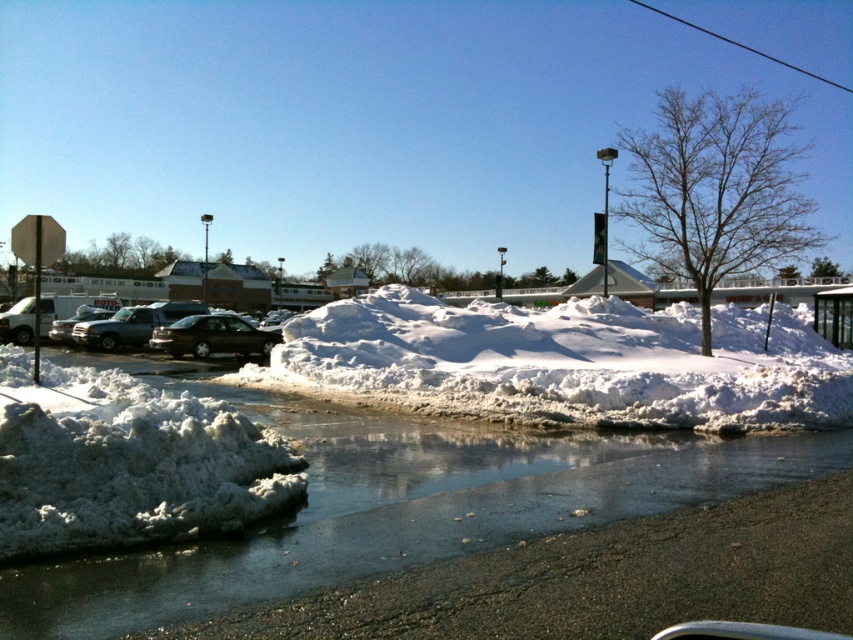
Question: Is the position of white fluffy snow at lower left less distant than that of matte black suv at center?

Choices:
 (A) yes
 (B) no

Answer: (A)

Question: Is white fluffy snow at center to the right of matte black suv at center from the viewer's perspective?

Choices:
 (A) no
 (B) yes

Answer: (B)

Question: Which object appears farthest from the camera in this image?

Choices:
 (A) matte black suv at center
 (B) white fluffy snow at center

Answer: (A)

Question: Which object is closer to the camera taking this photo?

Choices:
 (A) white frothy foam at lower left
 (B) silver metallic truck at left

Answer: (A)

Question: Does white fluffy snow at center have a smaller size compared to matte black suv at center?

Choices:
 (A) no
 (B) yes

Answer: (A)

Question: Which object is closer to the camera taking this photo?

Choices:
 (A) shiny black sedan at center
 (B) white frothy foam at lower left

Answer: (B)